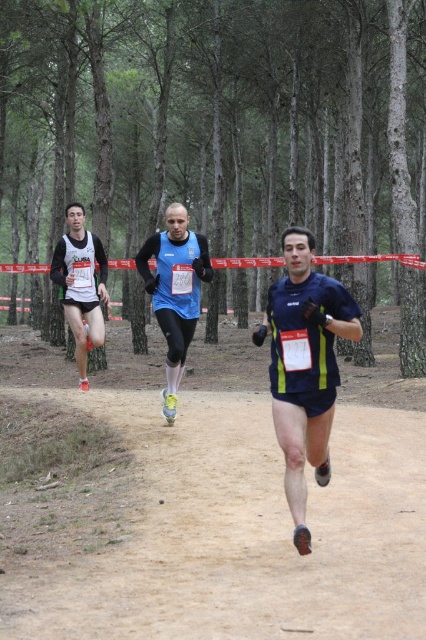
You are a photographer positioned at the starting line of the cross country race. You want to take a photo that includes both the green matte trees at center and the blue fabric running suit at center. Based on their positions, which object should appear higher in the photo?

The green matte trees at center should appear higher in the photo because they are positioned above the blue fabric running suit at center according to the description.

You are a photographer standing at the starting line of the cross country race. You want to take a photo of the dark blue athletic shorts at center. Where should you aim your camera to capture them?

You should aim your camera at point 0.573 on the x axis and point 0.716 on the y axis to capture the dark blue athletic shorts at center.

You are a runner participating in this cross country race. You are currently at the point marked as point (126, 92) and want to reach the point marked as point (164, 394). Which direction should you move to get closer to your destination?

You should move away from the viewer to reach point (164, 394) since it is further away from the viewer compared to your current position at point (126, 92).